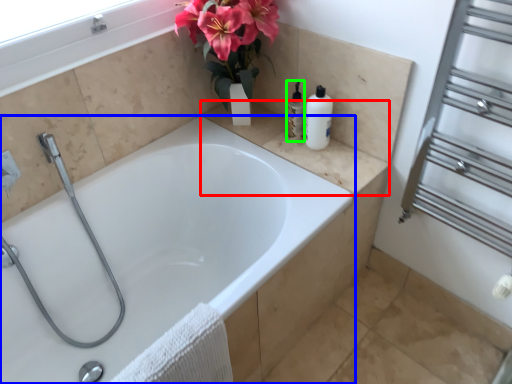
Question: Based on their relative distances, which object is nearer to counter top (highlighted by a red box)? Choose from bathtub (highlighted by a blue box) and toiletry (highlighted by a green box).

Choices:
 (A) bathtub
 (B) toiletry

Answer: (B)